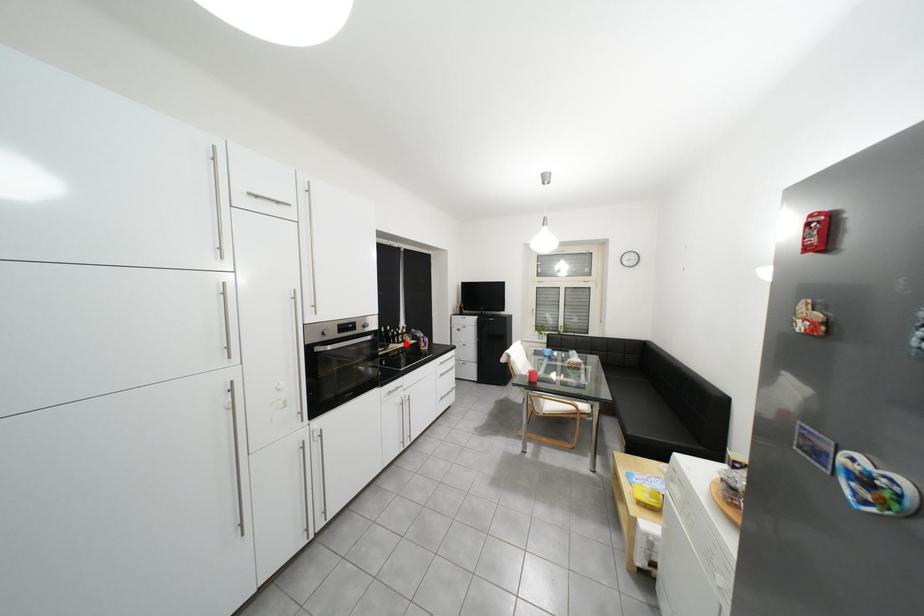
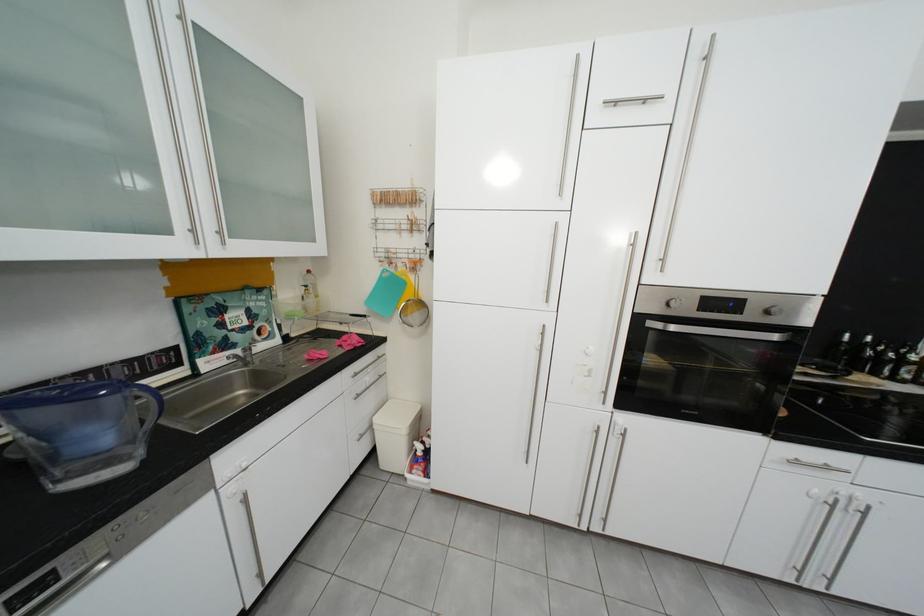
Locate, in the second image, the point that corresponds to the highlighted location in the first image.

(886, 375)